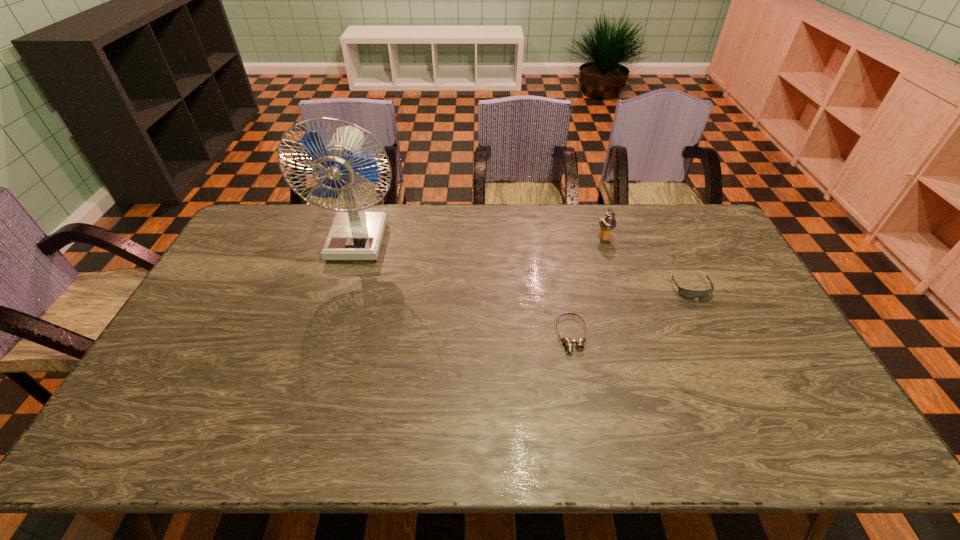
This screenshot has height=540, width=960. What are the coordinates of `unoccupied area between the second object from right to left and the third object from right to left` in the screenshot? It's located at (588, 286).

You are a GUI agent. You are given a task and a screenshot of the screen. Output one action in this format:
    pyautogui.click(x=<x>, y=<y>)
    Task: Click on the vacant space in between the shortest object and the third object from left to right
    
    Given the screenshot: What is the action you would take?
    pyautogui.click(x=588, y=286)

I want to click on vacant point located between the shorter goggles and the icecream, so click(x=588, y=286).

The image size is (960, 540). In order to click on empty location between the nearer goggles and the taller goggles in this screenshot , I will do `click(631, 311)`.

At what (x,y) coordinates should I click in order to perform the action: click on vacant point located between the nearer goggles and the taller goggles. Please return your answer as a coordinate pair (x, y). The image size is (960, 540). Looking at the image, I should click on (631, 311).

You are a GUI agent. You are given a task and a screenshot of the screen. Output one action in this format:
    pyautogui.click(x=<x>, y=<y>)
    Task: Click on the empty location between the third shortest object and the shorter goggles
    This screenshot has height=540, width=960.
    Given the screenshot: What is the action you would take?
    pyautogui.click(x=588, y=286)

Identify the location of empty space that is in between the third object from left to right and the shorter goggles. (588, 286).

At what (x,y) coordinates should I click in order to perform the action: click on free space between the nearer goggles and the rightmost object. Please return your answer as a coordinate pair (x, y). Looking at the image, I should click on (631, 311).

The width and height of the screenshot is (960, 540). What are the coordinates of `free spot between the rightmost object and the nearer goggles` in the screenshot? It's located at (631, 311).

Identify the location of vacant area between the third farthest object and the tallest object. Image resolution: width=960 pixels, height=540 pixels. (524, 262).